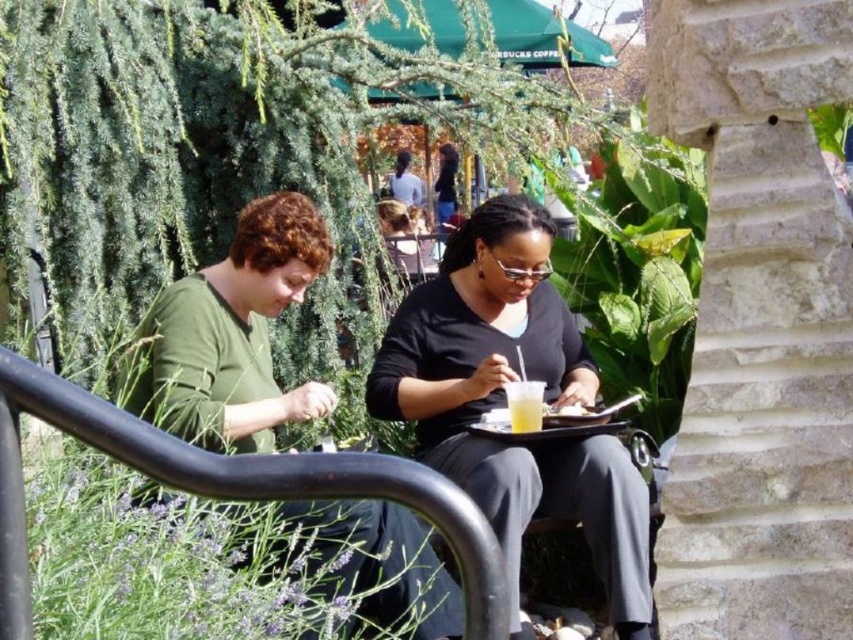
Question: Is black matte shirt at center to the right of dark brown hair at center from the viewer's perspective?

Choices:
 (A) no
 (B) yes

Answer: (B)

Question: Which object appears closest to the camera in this image?

Choices:
 (A) dark brown hair at center
 (B) translucent plastic cup at center
 (C) black matte shirt at center

Answer: (C)

Question: Considering the real-world distances, which object is farthest from the black matte shirt at center?

Choices:
 (A) dark brown hair at center
 (B) translucent plastic cup at center

Answer: (A)

Question: Does black matte shirt at center appear on the left side of translucent plastic cup at center?

Choices:
 (A) yes
 (B) no

Answer: (A)

Question: Which object is positioned farthest from the black matte shirt at center?

Choices:
 (A) translucent plastic cup at center
 (B) dark brown hair at center

Answer: (B)

Question: Is translucent plastic cup at center wider than dark brown hair at center?

Choices:
 (A) no
 (B) yes

Answer: (B)